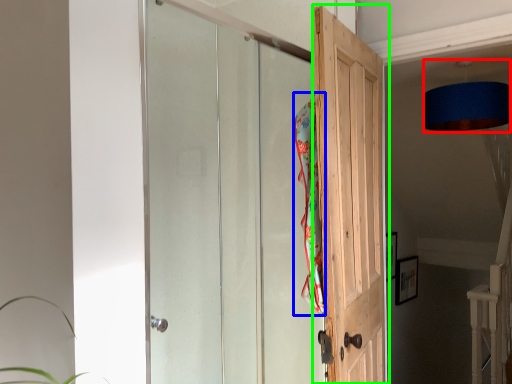
Question: Which object is the farthest from lamp (highlighted by a red box)? Choose among these: beach towel (highlighted by a blue box) or door (highlighted by a green box).

Choices:
 (A) beach towel
 (B) door

Answer: (A)